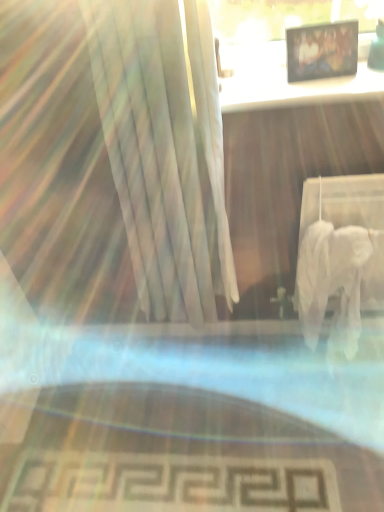
This screenshot has width=384, height=512. In order to click on empty space that is ontop of wooden table at upper center (from a real-world perspective) in this screenshot , I will do `click(297, 77)`.